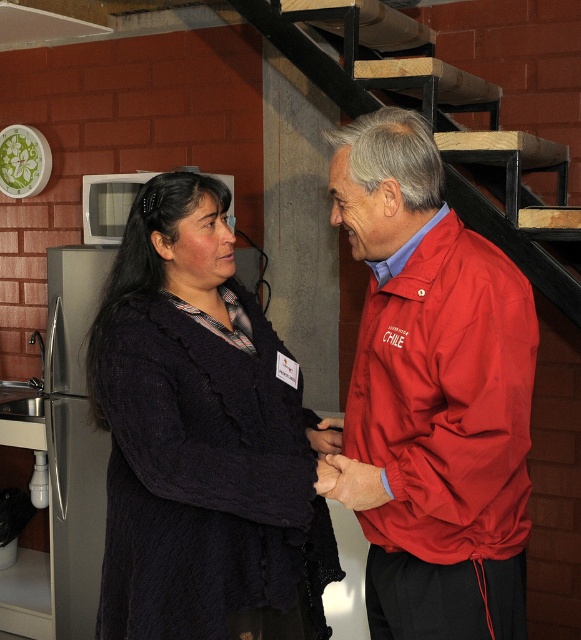
You are trying to decide whether to hang a large painting that requires a 1.5 meter tall space. Looking at the dark blue knitted sweater at center and the wooden stairs at upper center, which one has enough vertical space to accommodate the painting?

The dark blue knitted sweater at center is much taller than the wooden stairs at upper center, so it has enough vertical space to accommodate the painting.

You are a photographer setting up for a group photo in the kitchen. You need to ensure that the dark blue knitted sweater at center and the red nylon jacket at center are both visible in the frame. Based on their positions, which clothing item should you adjust to make sure both are fully visible?

The dark blue knitted sweater at center is positioned under the red nylon jacket at center, so you should adjust the red nylon jacket at center to move it upward or backward to allow the sweater to be fully visible.

You are standing in a kitchen and want to reach a point marked at coordinates point (268, 417). If you take a step forward of 2 feet, will you be closer to the point?

The distance between you and point (268, 417) is 5.50 feet. After stepping forward 2 feet, you will be 3.50 feet away from the point, so yes, you will be closer.